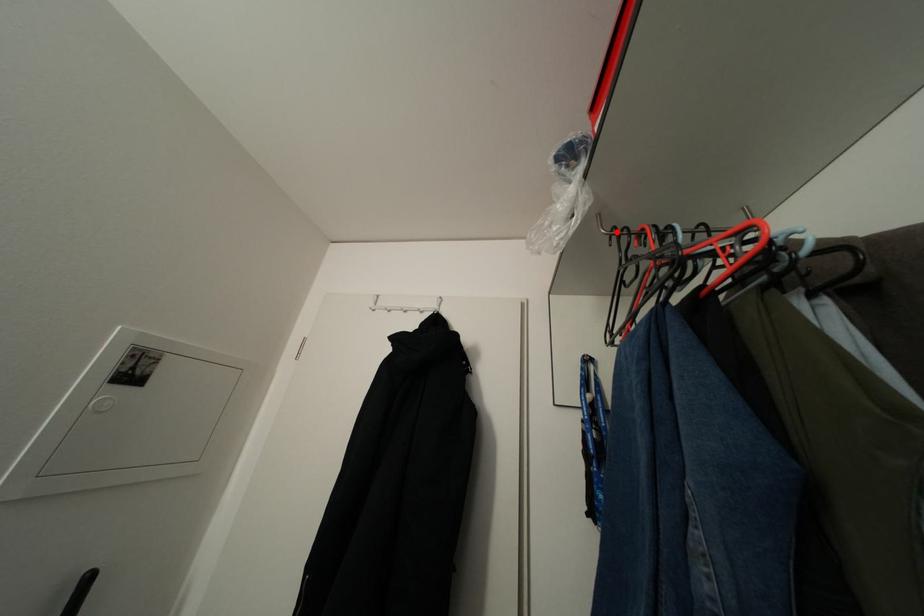
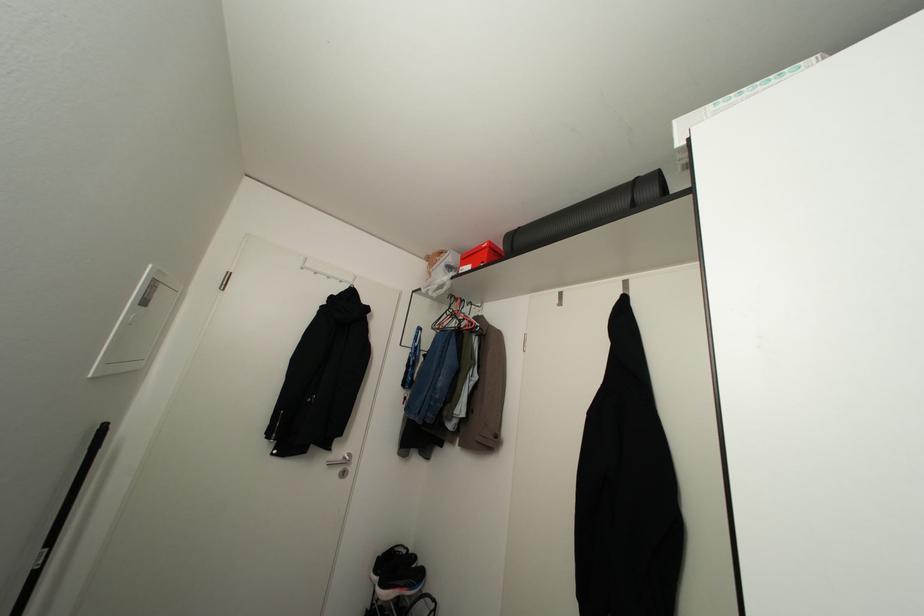
The point at the highlighted location is marked in the first image. Where is the corresponding point in the second image?

(451, 294)